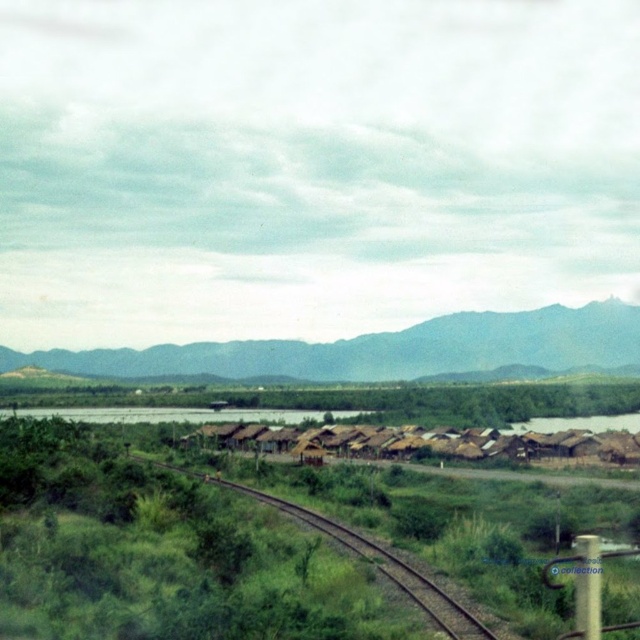
You are a hiker standing at the point marked by the coordinates point (x=381, y=349). Looking around, you see the green grassy mountain at upper center. Which direction should you head to reach the mountain?

The point (x=381, y=349) is located at the green grassy mountain at upper center, so you are already at the mountain.